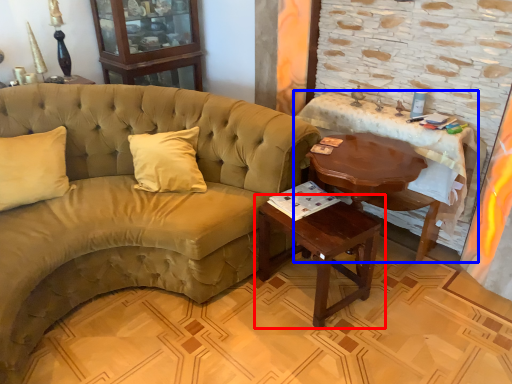
Question: Which point is closer to the camera, table (highlighted by a red box) or table (highlighted by a blue box)?

Choices:
 (A) table
 (B) table

Answer: (A)